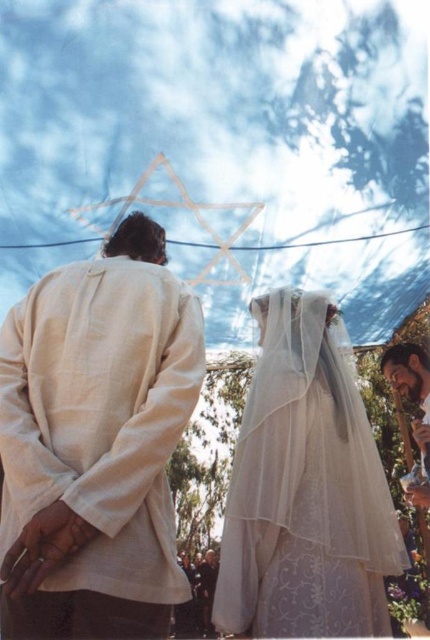
Question: Which of the following is the closest to the observer?

Choices:
 (A) bearded man at lower right
 (B) white sheer veil at center
 (C) light beige linen shirt at center

Answer: (C)

Question: Is white sheer veil at center positioned before bearded man at lower right?

Choices:
 (A) no
 (B) yes

Answer: (B)

Question: Does white sheer veil at center have a smaller size compared to bearded man at lower right?

Choices:
 (A) yes
 (B) no

Answer: (B)

Question: Considering the real-world distances, which object is closest to the bearded man at lower right?

Choices:
 (A) white sheer veil at center
 (B) light beige linen shirt at center

Answer: (A)

Question: Among these objects, which one is nearest to the camera?

Choices:
 (A) light beige linen shirt at center
 (B) bearded man at lower right
 (C) white sheer veil at center

Answer: (A)

Question: Does light beige linen shirt at center appear under bearded man at lower right?

Choices:
 (A) yes
 (B) no

Answer: (B)